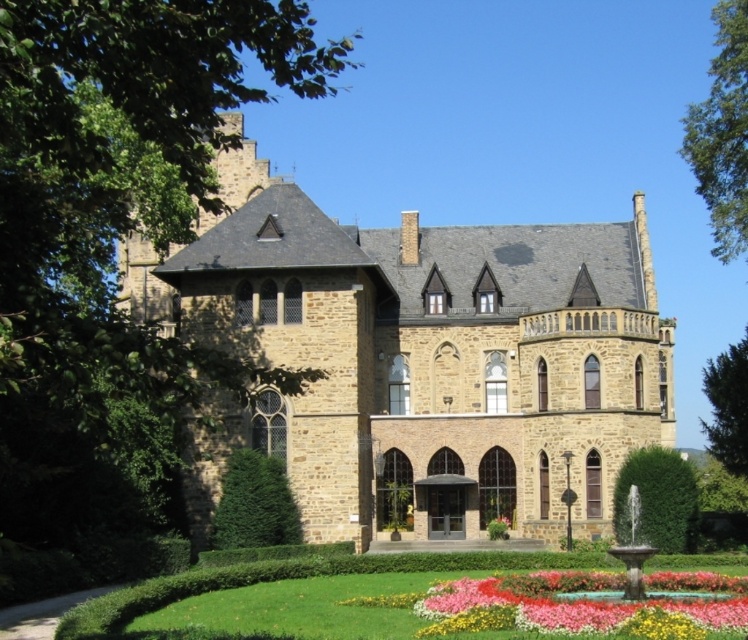
Based on the photo, is vivid floral carpet at center to the right of pink fabric flower at center from the viewer's perspective?

Yes, vivid floral carpet at center is to the right of pink fabric flower at center.

Can you confirm if vivid floral carpet at center is taller than pink fabric flower at center?

Correct, vivid floral carpet at center is much taller as pink fabric flower at center.

Describe the element at coordinates (589, 600) in the screenshot. I see `vivid floral carpet at center` at that location.

Where is `vivid floral carpet at center`? This screenshot has height=640, width=748. vivid floral carpet at center is located at coordinates click(x=589, y=600).

Which is below, green grass at lower center or green leafy hedge at lower right?

green grass at lower center

How far apart are green grass at lower center and green leafy hedge at lower right?

A distance of 6.62 meters exists between green grass at lower center and green leafy hedge at lower right.

This screenshot has width=748, height=640. Describe the element at coordinates (289, 577) in the screenshot. I see `green grass at lower center` at that location.

Locate an element on the screen. This screenshot has height=640, width=748. green grass at lower center is located at coordinates (289, 577).

Between stone mansion at center and green leafy hedge at lower right, which one appears on the left side from the viewer's perspective?

stone mansion at center is more to the left.

Is stone mansion at center positioned before green leafy hedge at lower right?

No, it is not.

Find the location of `stone mansion at center`. stone mansion at center is located at coordinates (420, 358).